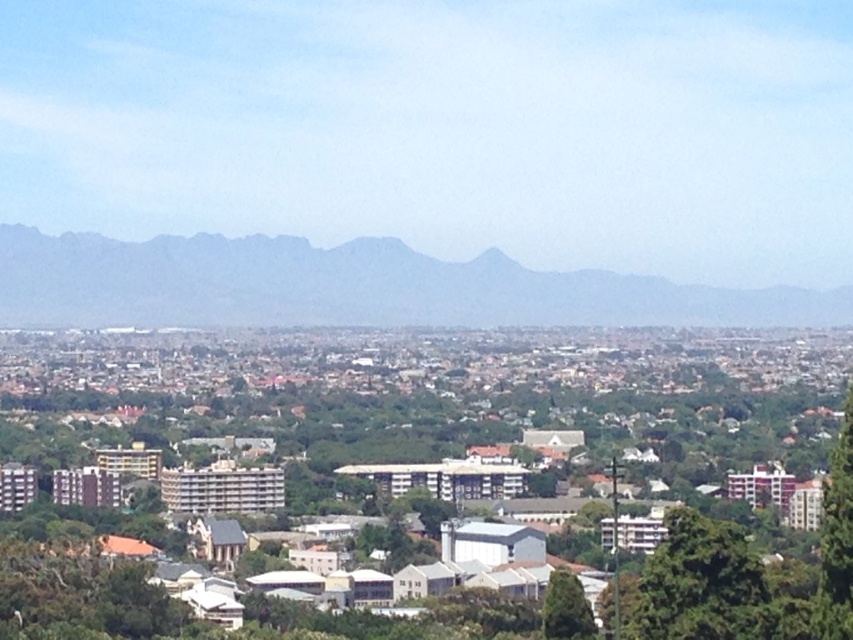
You are a drone operator trying to capture a photo of the gray rocky mountain at center and the green leafy tree at lower center. Which object should you focus on first if you want to take a clear photo of both in one shot?

You should focus on the gray rocky mountain at center first because it is closer to the viewer than the green leafy tree at lower center, so adjusting focus from near to far will ensure both are in focus.

From the picture: You are a city planner analyzing the urban layout. Given the presence of the gray rocky mountain at center and the green leafy tree at lower right, which object would require more space for preservation efforts?

The gray rocky mountain at center requires more space for preservation efforts because it is larger in size than the green leafy tree at lower right.

You are a drone operator trying to navigate between two points in the urban landscape. You need to fly from point A to point B. If point A is at point (131, 288) and point B is at point (561, 595), which point is closer to your current position when you start at the camera position?

Point A at (131, 288) is closer to the camera position than point B at (561, 595) because it is further to the camera.